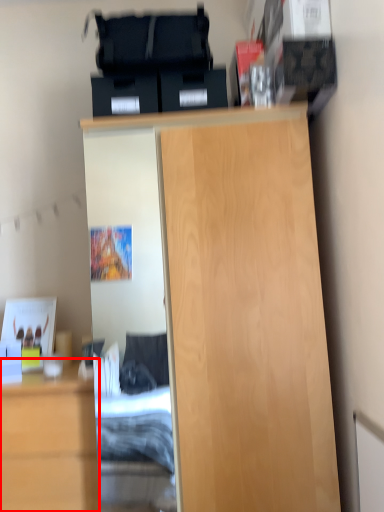
Question: Where is cabinetry (annotated by the red box) located in relation to cupboard in the image?

Choices:
 (A) left
 (B) right

Answer: (A)